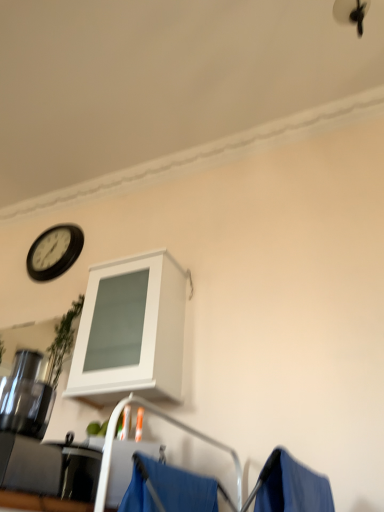
Question: Based on their sizes in the image, would you say blue fabric at lower center is bigger or smaller than black plastic clock at upper left?

Choices:
 (A) small
 (B) big

Answer: (A)

Question: Visually, is blue fabric at lower center positioned to the left or to the right of black plastic clock at upper left?

Choices:
 (A) right
 (B) left

Answer: (A)

Question: Which is farther from the white matte cabinet at upper center?

Choices:
 (A) black plastic clock at upper left
 (B) blue fabric at lower center

Answer: (A)

Question: Based on their relative distances, which object is farther from the white matte cabinet at upper center?

Choices:
 (A) black plastic clock at upper left
 (B) blue fabric at lower center

Answer: (A)